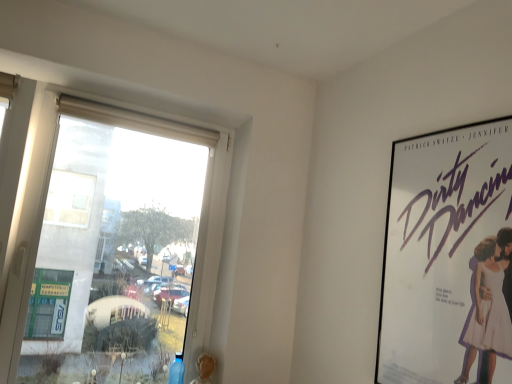
Describe the element at coordinates (114, 244) in the screenshot. Image resolution: width=512 pixels, height=384 pixels. I see `transparent glass window at left` at that location.

Where is `transparent glass window at left`? This screenshot has width=512, height=384. transparent glass window at left is located at coordinates (114, 244).

What do you see at coordinates (448, 258) in the screenshot? I see `white paper poster at right` at bounding box center [448, 258].

This screenshot has height=384, width=512. What are the coordinates of `white paper poster at right` in the screenshot? It's located at (448, 258).

Where is `transparent glass window at left`? transparent glass window at left is located at coordinates (114, 244).

Which is more to the right, transparent glass window at left or white paper poster at right?

white paper poster at right is more to the right.

From the picture: Is transparent glass window at left in front of or behind white paper poster at right in the image?

Visually, transparent glass window at left is located behind white paper poster at right.

Which is closer, (31,170) or (461,355)?

Point (31,170) is farther from the camera than point (461,355).

From the image's perspective, between transparent glass window at left and white paper poster at right, who is located below?

white paper poster at right, from the image's perspective.

From a real-world perspective, is transparent glass window at left positioned above or below white paper poster at right?

From a real-world perspective, transparent glass window at left is physically below white paper poster at right.

Is transparent glass window at left thinner than white paper poster at right?

Incorrect, the width of transparent glass window at left is not less than that of white paper poster at right.

In the scene shown: Is transparent glass window at left shorter than white paper poster at right?

No, transparent glass window at left is not shorter than white paper poster at right.

Who is bigger, transparent glass window at left or white paper poster at right?

Bigger between the two is transparent glass window at left.

Is transparent glass window at left completely or partially outside of white paper poster at right?

Yes.

In the scene shown: Is there a large distance between transparent glass window at left and white paper poster at right?

Yes.

Is transparent glass window at left facing towards white paper poster at right?

No, transparent glass window at left is not aimed at white paper poster at right.

How different are the orientations of transparent glass window at left and white paper poster at right in degrees?

The angle between the facing direction of transparent glass window at left and the facing direction of white paper poster at right is 90 degrees.

Based on the photo, measure the distance between transparent glass window at left and white paper poster at right.

They are 4.52 feet apart.

Find the location of a particular element. Image resolution: width=512 pixels, height=384 pixels. poster positioned vertically above the transparent glass window at left (from a real-world perspective) is located at coordinates (448, 258).

Looking at this image, which is more to the left, white paper poster at right or transparent glass window at left?

transparent glass window at left.

Which is behind, white paper poster at right or transparent glass window at left?

transparent glass window at left is further away from the camera.

Considering the points (407, 199) and (68, 364), which point is in front, point (407, 199) or point (68, 364)?

The point (407, 199) is in front.

From the image's perspective, is white paper poster at right located above or below transparent glass window at left?

white paper poster at right is below transparent glass window at left.

From a real-world perspective, which object stands above the other?

white paper poster at right is physically above.

Is white paper poster at right thinner than transparent glass window at left?

Yes, white paper poster at right is thinner than transparent glass window at left.

Who is taller, white paper poster at right or transparent glass window at left?

With more height is transparent glass window at left.

Considering the sizes of objects white paper poster at right and transparent glass window at left in the image provided, who is smaller, white paper poster at right or transparent glass window at left?

Smaller between the two is white paper poster at right.

Is white paper poster at right not inside transparent glass window at left?

Yes, white paper poster at right is not within transparent glass window at left.

Is white paper poster at right directly adjacent to transparent glass window at left?

white paper poster at right and transparent glass window at left are not in contact.

Does white paper poster at right turn towards transparent glass window at left?

No.

You are a GUI agent. You are given a task and a screenshot of the screen. Output one action in this format:
    pyautogui.click(x=<x>, y=<y>)
    Task: Click on the poster on the right of the transparent glass window at left
    
    Given the screenshot: What is the action you would take?
    pyautogui.click(x=448, y=258)

This screenshot has width=512, height=384. I want to click on poster positioned vertically above the transparent glass window at left (from a real-world perspective), so (448, 258).

This screenshot has height=384, width=512. Identify the location of poster that is below the transparent glass window at left (from the image's perspective). (448, 258).